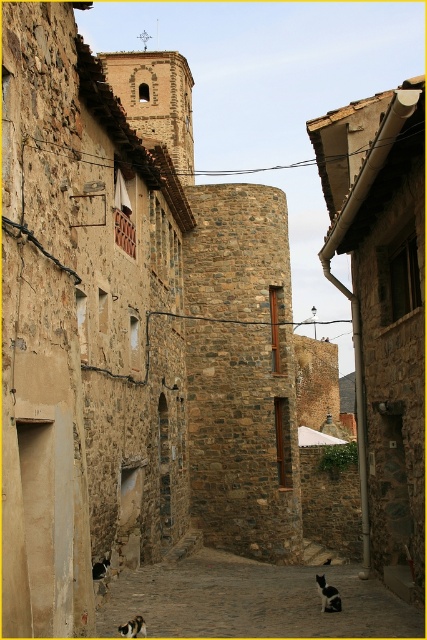
Consider the image. Who is positioned more to the right, black fur cat at lower center or calico fur cat at lower center?

black fur cat at lower center is more to the right.

Does black fur cat at lower center appear under calico fur cat at lower center?

Yes, black fur cat at lower center is below calico fur cat at lower center.

Does point (321, 598) come farther from viewer compared to point (137, 634)?

Yes, it is behind point (137, 634).

In order to click on black fur cat at lower center in this screenshot , I will do `click(327, 595)`.

Between brown stone alley at center and calico fur cat at lower center, which one has less height?

Standing shorter between the two is calico fur cat at lower center.

Describe the element at coordinates (253, 600) in the screenshot. The width and height of the screenshot is (427, 640). I see `brown stone alley at center` at that location.

Between point (368, 609) and point (128, 627), which one is positioned in front?

Point (128, 627) is in front.

Find the location of `brown stone alley at center`. brown stone alley at center is located at coordinates (253, 600).

Which is below, brown stone alley at center or black fur cat at lower center?

brown stone alley at center is below.

Based on the photo, does brown stone alley at center have a greater width compared to black fur cat at lower center?

Yes, brown stone alley at center is wider than black fur cat at lower center.

Between point (256, 588) and point (321, 611), which one is positioned in front?

Point (321, 611) is more forward.

Locate an element on the screen. Image resolution: width=427 pixels, height=640 pixels. brown stone alley at center is located at coordinates (253, 600).